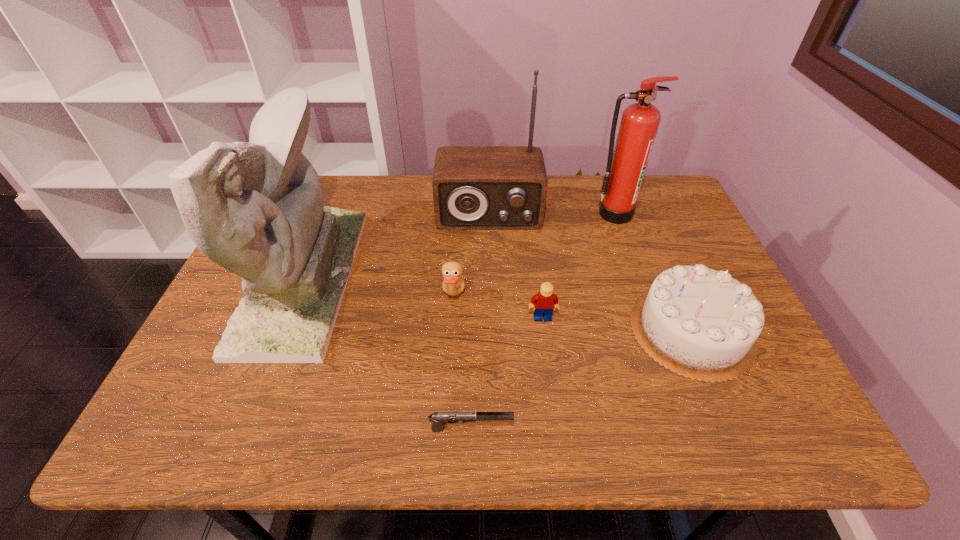
Image resolution: width=960 pixels, height=540 pixels. What are the coordinates of `vacant space located on the front-facing side of the radio receiver` in the screenshot? It's located at (491, 298).

The image size is (960, 540). In order to click on free region located on the back of the birthday cake in this screenshot , I will do `click(656, 245)`.

You are a GUI agent. You are given a task and a screenshot of the screen. Output one action in this format:
    pyautogui.click(x=<x>, y=<y>)
    Task: Click on the vacant space located 0.100m on the front-facing side of the Lego
    The image size is (960, 540).
    Given the screenshot: What is the action you would take?
    pyautogui.click(x=548, y=357)

This screenshot has height=540, width=960. Find the location of `free space located 0.380m on the beak of the duck`. free space located 0.380m on the beak of the duck is located at coordinates (617, 296).

Locate an element on the screen. vacant space positioned at the muzzle end of the gun is located at coordinates (641, 429).

This screenshot has height=540, width=960. I want to click on sculpture located at the far edge, so click(257, 209).

What are the coordinates of `fire extinguisher situated at the far edge` in the screenshot? It's located at (626, 166).

The width and height of the screenshot is (960, 540). In order to click on radio receiver at the far edge in this screenshot , I will do `click(474, 187)`.

Find the location of `object that is at the near edge`. object that is at the near edge is located at coordinates [439, 419].

Locate an element on the screen. This screenshot has width=960, height=540. object located at the left edge is located at coordinates (257, 209).